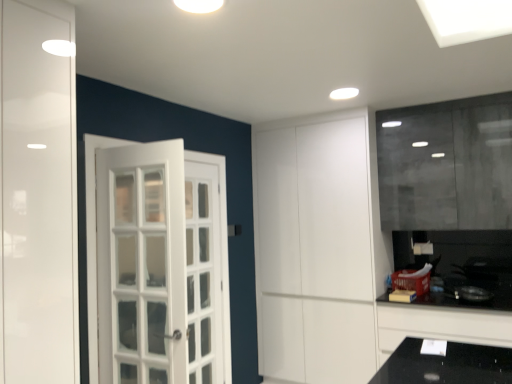
Question: Is black glossy countertop at lower right to the right of white matte cabinet at center from the viewer's perspective?

Choices:
 (A) no
 (B) yes

Answer: (B)

Question: From the image's perspective, is black glossy countertop at lower right over white matte cabinet at center?

Choices:
 (A) yes
 (B) no

Answer: (B)

Question: Is black glossy countertop at lower right completely or partially outside of white matte cabinet at center?

Choices:
 (A) no
 (B) yes

Answer: (B)

Question: Can you confirm if black glossy countertop at lower right is smaller than white matte cabinet at center?

Choices:
 (A) yes
 (B) no

Answer: (A)

Question: Does black glossy countertop at lower right have a lesser width compared to white matte cabinet at center?

Choices:
 (A) yes
 (B) no

Answer: (A)

Question: Can you confirm if black glossy countertop at lower right is taller than white matte cabinet at center?

Choices:
 (A) no
 (B) yes

Answer: (A)

Question: Is white matte cabinet at center in contact with black glossy countertop at lower right?

Choices:
 (A) no
 (B) yes

Answer: (A)

Question: Is white matte cabinet at center further to camera compared to black glossy countertop at lower right?

Choices:
 (A) yes
 (B) no

Answer: (A)

Question: Is white matte cabinet at center oriented towards black glossy countertop at lower right?

Choices:
 (A) yes
 (B) no

Answer: (B)

Question: Is white matte cabinet at center positioned in front of black glossy countertop at lower right?

Choices:
 (A) yes
 (B) no

Answer: (B)

Question: Would you consider white matte cabinet at center to be distant from black glossy countertop at lower right?

Choices:
 (A) no
 (B) yes

Answer: (A)

Question: Is white matte cabinet at center smaller than black glossy countertop at lower right?

Choices:
 (A) no
 (B) yes

Answer: (A)

Question: Looking at their shapes, would you say black glossy countertop at lower right is wider or thinner than white matte cabinet at center?

Choices:
 (A) thin
 (B) wide

Answer: (A)